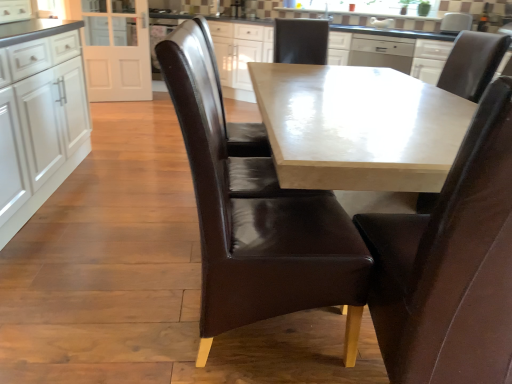
This screenshot has width=512, height=384. Describe the element at coordinates (429, 59) in the screenshot. I see `white glossy cabinet at upper center, the first cabinetry in the right-to-left sequence` at that location.

What is the approximate height of brown leather chair at center, positioned as the 2th chair in left-to-right order?

1.01 meters.

What do you see at coordinates (455, 23) in the screenshot?
I see `white glossy microwave at upper center` at bounding box center [455, 23].

Where is `satin silver dishwasher at upper center`? The image size is (512, 384). satin silver dishwasher at upper center is located at coordinates (381, 52).

Locate an element on the screen. The image size is (512, 384). brown leather chair at center, positioned as the 2th chair in right-to-left order is located at coordinates (451, 264).

How much space does white glossy cabinets at left, positioned as the second cabinetry in back-to-front order, occupy horizontally?

The width of white glossy cabinets at left, positioned as the second cabinetry in back-to-front order, is 24.91 inches.

Find the location of a particular element. The height and width of the screenshot is (384, 512). white glossy cabinet at upper center, the first cabinetry in the right-to-left sequence is located at coordinates (429, 59).

Which object is wider, brown leather chair at center, marked as the 4th chair in a right-to-left arrangement, or white glossy sink at upper center?

brown leather chair at center, marked as the 4th chair in a right-to-left arrangement, is wider.

Between brown leather chair at center, marked as the 4th chair in a right-to-left arrangement, and white glossy sink at upper center, which one has larger size?

brown leather chair at center, marked as the 4th chair in a right-to-left arrangement.

From a real-world perspective, is brown leather chair at center, placed as the 1th chair when sorted from left to right, beneath white glossy sink at upper center?

Yes, from a real-world perspective, brown leather chair at center, placed as the 1th chair when sorted from left to right, is below white glossy sink at upper center.

In the scene shown: Considering the sizes of objects satin silver dishwasher at upper center and white glossy microwave at upper center in the image provided, who is taller, satin silver dishwasher at upper center or white glossy microwave at upper center?

With more height is satin silver dishwasher at upper center.

Consider the image. Is satin silver dishwasher at upper center at the left side of white glossy microwave at upper center?

Indeed, satin silver dishwasher at upper center is positioned on the left side of white glossy microwave at upper center.

Is satin silver dishwasher at upper center positioned with its back to white glossy microwave at upper center?

No, satin silver dishwasher at upper center is not facing the opposite direction of white glossy microwave at upper center.

Which of these two, white glossy sink at upper center or white glossy cabinets at left, positioned as the second cabinetry in back-to-front order, is wider?

Wider between the two is white glossy cabinets at left, positioned as the second cabinetry in back-to-front order.

Is white glossy cabinets at left, the second cabinetry when ordered from right to left, inside white glossy sink at upper center?

No, white glossy cabinets at left, the second cabinetry when ordered from right to left, is not inside white glossy sink at upper center.

Between white glossy sink at upper center and white glossy cabinets at left, positioned as the second cabinetry in back-to-front order, which one has more height?

white glossy cabinets at left, positioned as the second cabinetry in back-to-front order, is taller.

Between white glossy sink at upper center and white glossy cabinets at left, which is the 1th cabinetry in front-to-back order, which one appears on the right side from the viewer's perspective?

Positioned to the right is white glossy sink at upper center.

From the image's perspective, is white glossy cabinet at upper center, which is counted as the 2th cabinetry, starting from the left, beneath white glossy cabinets at left, the first cabinetry in the left-to-right sequence?

Actually, white glossy cabinet at upper center, which is counted as the 2th cabinetry, starting from the left, appears above white glossy cabinets at left, the first cabinetry in the left-to-right sequence, in the image.

From a real-world perspective, which is physically below, white glossy cabinet at upper center, positioned as the 1th cabinetry in back-to-front order, or white glossy cabinets at left, the first cabinetry in the left-to-right sequence?

In real-world perspective, white glossy cabinets at left, the first cabinetry in the left-to-right sequence, is lower.

How many degrees apart are the facing directions of white glossy cabinet at upper center, positioned as the 1th cabinetry in back-to-front order, and white glossy cabinets at left, the first cabinetry in the left-to-right sequence?

white glossy cabinet at upper center, positioned as the 1th cabinetry in back-to-front order, and white glossy cabinets at left, the first cabinetry in the left-to-right sequence, are facing 125 degrees away from each other.

Considering their positions, is white glossy cabinet at upper center, which is counted as the 2th cabinetry, starting from the left, located in front of or behind brown leather chair at upper right, which is the 1th chair in right-to-left order?

In the image, white glossy cabinet at upper center, which is counted as the 2th cabinetry, starting from the left, appears behind brown leather chair at upper right, which is the 1th chair in right-to-left order.

From a real-world perspective, who is located higher, white glossy cabinet at upper center, positioned as the 1th cabinetry in back-to-front order, or brown leather chair at upper right, which is the 1th chair in right-to-left order?

In real-world perspective, brown leather chair at upper right, which is the 1th chair in right-to-left order, is above.

Looking at the image, does white glossy cabinet at upper center, the first cabinetry in the right-to-left sequence, seem bigger or smaller compared to brown leather chair at upper right, the fourth chair viewed from the left?

Considering their sizes, white glossy cabinet at upper center, the first cabinetry in the right-to-left sequence, takes up more space than brown leather chair at upper right, the fourth chair viewed from the left.

Can you tell me how much white glossy cabinet at upper center, the first cabinetry in the right-to-left sequence, and brown leather chair at upper right, which is the 1th chair in right-to-left order, differ in facing direction?

58.9 degrees.

What's the angular difference between white glossy sink at upper center and white glossy cabinet at upper center, which is counted as the 2th cabinetry, starting from the left,'s facing directions?

28.4 degrees.

Would you say white glossy sink at upper center is outside white glossy cabinet at upper center, which is counted as the 2th cabinetry, starting from the left?

Indeed, white glossy sink at upper center is completely outside white glossy cabinet at upper center, which is counted as the 2th cabinetry, starting from the left.

Does point (323, 15) come behind point (441, 62)?

Yes, it is.

Is white glossy sink at upper center next to white glossy cabinet at upper center, positioned as the 1th cabinetry in back-to-front order, and touching it?

white glossy sink at upper center and white glossy cabinet at upper center, positioned as the 1th cabinetry in back-to-front order, are not in contact.

From a real-world perspective, is brown leather chair at center, positioned as the 2th chair in right-to-left order, on white glossy cabinet at upper center, the first cabinetry in the right-to-left sequence?

No, from a real-world perspective, brown leather chair at center, positioned as the 2th chair in right-to-left order, is not over white glossy cabinet at upper center, the first cabinetry in the right-to-left sequence

Considering the relative positions of brown leather chair at center, marked as the third chair in a left-to-right arrangement, and white glossy cabinet at upper center, the first cabinetry in the right-to-left sequence, in the image provided, is brown leather chair at center, marked as the third chair in a left-to-right arrangement, behind white glossy cabinet at upper center, the first cabinetry in the right-to-left sequence,?

No, it is in front of white glossy cabinet at upper center, the first cabinetry in the right-to-left sequence.

Which object is wider, brown leather chair at center, marked as the third chair in a left-to-right arrangement, or white glossy cabinet at upper center, positioned as the 1th cabinetry in back-to-front order?

With larger width is white glossy cabinet at upper center, positioned as the 1th cabinetry in back-to-front order.

Based on the photo, from the image's perspective, is brown leather chair at center, positioned as the 2th chair in right-to-left order, beneath white glossy cabinet at upper center, positioned as the 1th cabinetry in back-to-front order?

Yes, from the image's perspective, brown leather chair at center, positioned as the 2th chair in right-to-left order, is below white glossy cabinet at upper center, positioned as the 1th cabinetry in back-to-front order.

This screenshot has height=384, width=512. In order to click on sink above the brown leather chair at center, marked as the 4th chair in a right-to-left arrangement (from a real-world perspective) in this screenshot , I will do `click(326, 14)`.

The image size is (512, 384). I want to click on appliance in front of the satin silver dishwasher at upper center, so click(455, 23).

Based on their spatial positions, is brown leather chair at center, positioned as the 2th chair in left-to-right order, or brown leather chair at center, marked as the 4th chair in a right-to-left arrangement, further from white glossy microwave at upper center?

brown leather chair at center, positioned as the 2th chair in left-to-right order.

Looking at the image, which one is located further to white glossy microwave at upper center, brown leather chair at upper right, the fourth chair viewed from the left, or white glossy cabinets at left, positioned as the second cabinetry in back-to-front order?

white glossy cabinets at left, positioned as the second cabinetry in back-to-front order, is positioned further to the anchor white glossy microwave at upper center.

When comparing their distances from white glossy microwave at upper center, does brown leather chair at center, marked as the 4th chair in a right-to-left arrangement, or satin silver dishwasher at upper center seem closer?

satin silver dishwasher at upper center lies closer to white glossy microwave at upper center than the other object.

When comparing their distances from brown leather chair at center, marked as the third chair in a left-to-right arrangement, does white glossy cabinet at upper center, the first cabinetry in the right-to-left sequence, or brown leather chair at upper right, which is the 1th chair in right-to-left order, seem further?

The object further to brown leather chair at center, marked as the third chair in a left-to-right arrangement, is white glossy cabinet at upper center, the first cabinetry in the right-to-left sequence.

Looking at the image, which one is located further to white glossy cabinet at upper center, the first cabinetry in the right-to-left sequence, white glossy microwave at upper center or brown leather chair at center, acting as the 3th chair starting from the right?

brown leather chair at center, acting as the 3th chair starting from the right, is positioned further to the anchor white glossy cabinet at upper center, the first cabinetry in the right-to-left sequence.

Looking at the image, which one is located further to brown leather chair at center, placed as the 1th chair when sorted from left to right, white glossy cabinets at left, the second cabinetry when ordered from right to left, or white glossy cabinet at upper center, the second cabinetry positioned from the front?

white glossy cabinet at upper center, the second cabinetry positioned from the front, is positioned further to the anchor brown leather chair at center, placed as the 1th chair when sorted from left to right.

Considering their positions, is satin silver dishwasher at upper center positioned closer to white glossy sink at upper center than white glossy cabinet at upper center, positioned as the 1th cabinetry in back-to-front order?

satin silver dishwasher at upper center.

Which object lies further to the anchor point brown leather chair at center, marked as the third chair in a left-to-right arrangement, white glossy cabinet at upper center, the first cabinetry in the right-to-left sequence, or satin silver dishwasher at upper center?

Among the two, satin silver dishwasher at upper center is located further to brown leather chair at center, marked as the third chair in a left-to-right arrangement.

The width and height of the screenshot is (512, 384). I want to click on cabinetry between white glossy cabinets at left, which is the 1th cabinetry in front-to-back order, and white glossy microwave at upper center, in the horizontal direction, so click(429, 59).

Locate an element on the screen. The width and height of the screenshot is (512, 384). appliance between brown leather chair at upper right, which is the 1th chair in right-to-left order, and white glossy sink at upper center in the front-back direction is located at coordinates (455, 23).

This screenshot has width=512, height=384. I want to click on dish washer between white glossy cabinets at left, which is the 1th cabinetry in front-to-back order, and white glossy sink at upper center in the front-back direction, so click(x=381, y=52).

Locate an element on the screen. cabinetry between brown leather chair at upper right, which is the 1th chair in right-to-left order, and white glossy microwave at upper center in the front-back direction is located at coordinates (429, 59).